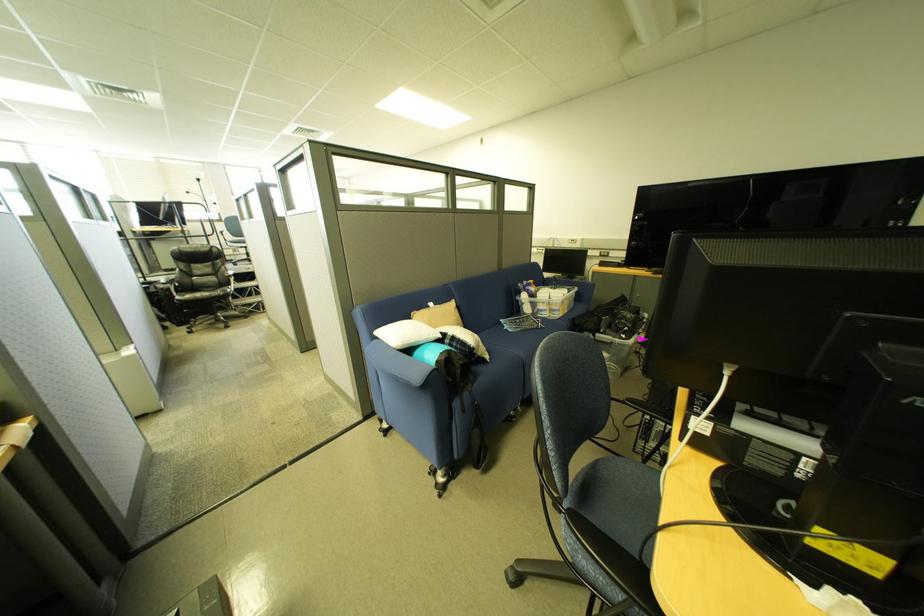
The width and height of the screenshot is (924, 616). Find the location of `white pillow`. white pillow is located at coordinates (406, 334).